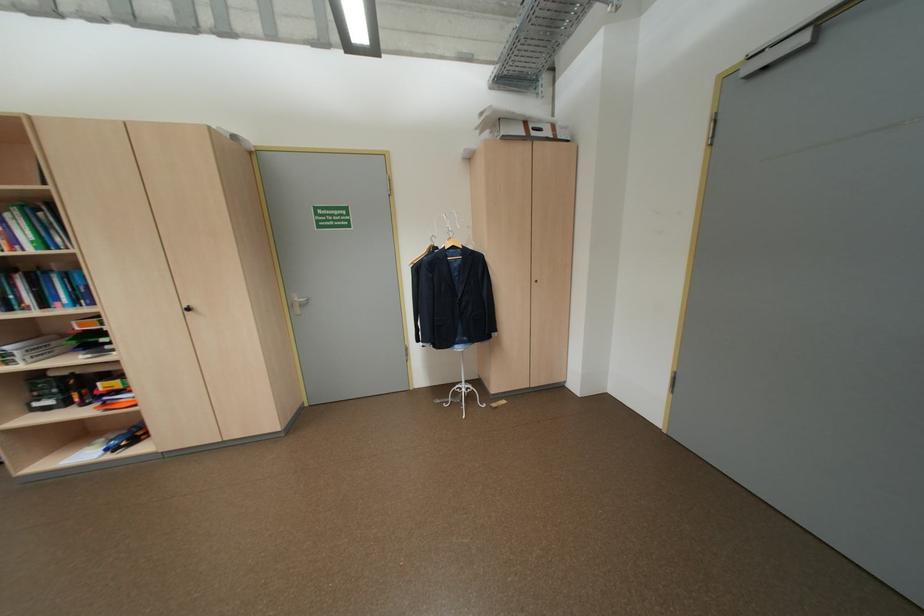
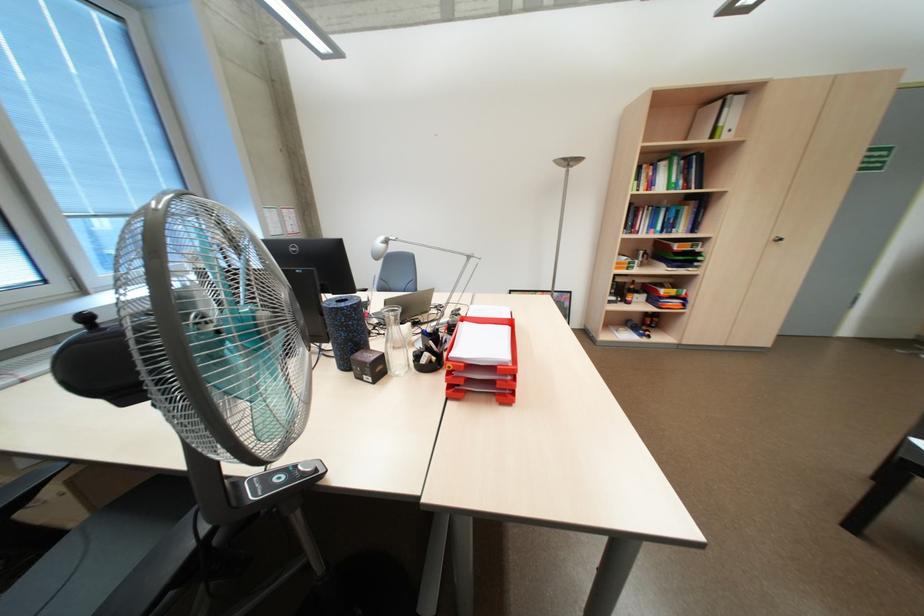
Question: The images are taken continuously from a first-person perspective. In which direction are you moving?

Choices:
 (A) Left
 (B) Right
 (C) Forward
 (D) Backward

Answer: (A)